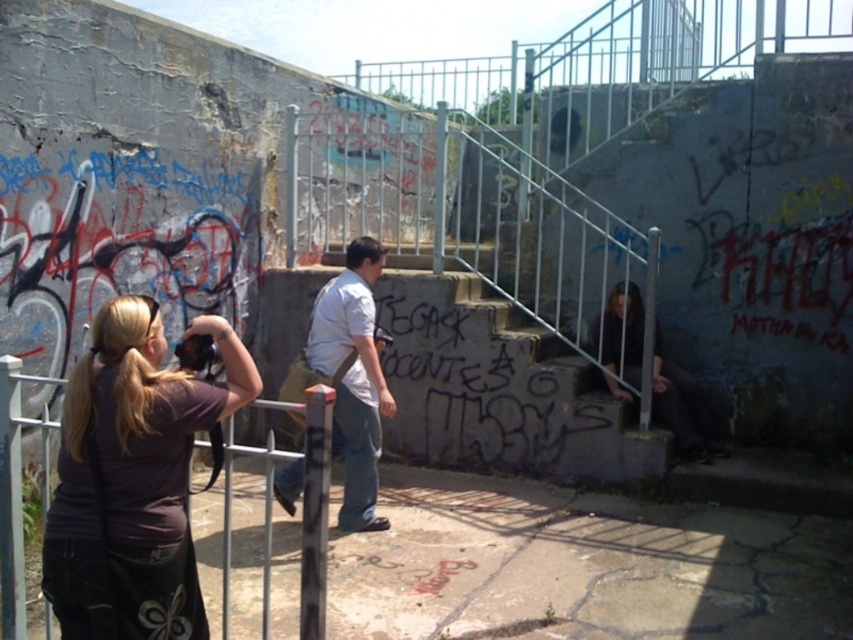
Consider the image. You are a photographer trying to capture the graffiti on the stairs. The matte purple shirt at left is in your shot. Where should you move your camera to avoid the shirt?

Move the camera to the right since the matte purple shirt at left is located at point [129,456] which is on the left side of the frame.